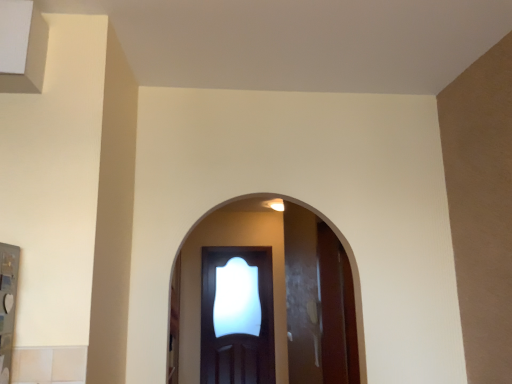
Question: Are glossy wood door at center and clear glass screen door at center beside each other?

Choices:
 (A) no
 (B) yes

Answer: (A)

Question: Is glossy wood door at center aimed at clear glass screen door at center?

Choices:
 (A) no
 (B) yes

Answer: (A)

Question: Is glossy wood door at center not near clear glass screen door at center?

Choices:
 (A) no
 (B) yes

Answer: (B)

Question: Is glossy wood door at center thinner than clear glass screen door at center?

Choices:
 (A) no
 (B) yes

Answer: (A)

Question: Is glossy wood door at center to the left of clear glass screen door at center from the viewer's perspective?

Choices:
 (A) yes
 (B) no

Answer: (B)

Question: Is glossy wood door at center not within clear glass screen door at center?

Choices:
 (A) no
 (B) yes

Answer: (B)

Question: Is clear glass screen door at center at the right side of glossy wood door at center?

Choices:
 (A) no
 (B) yes

Answer: (A)

Question: Is clear glass screen door at center outside of glossy wood door at center?

Choices:
 (A) no
 (B) yes

Answer: (B)

Question: From the image's perspective, is clear glass screen door at center under glossy wood door at center?

Choices:
 (A) no
 (B) yes

Answer: (B)

Question: Is clear glass screen door at center not close to glossy wood door at center?

Choices:
 (A) no
 (B) yes

Answer: (B)

Question: From a real-world perspective, is clear glass screen door at center positioned over glossy wood door at center based on gravity?

Choices:
 (A) yes
 (B) no

Answer: (B)

Question: Is clear glass screen door at center behind glossy wood door at center?

Choices:
 (A) yes
 (B) no

Answer: (B)

Question: From a real-world perspective, is glossy wood door at center positioned above or below clear glass screen door at center?

Choices:
 (A) below
 (B) above

Answer: (B)